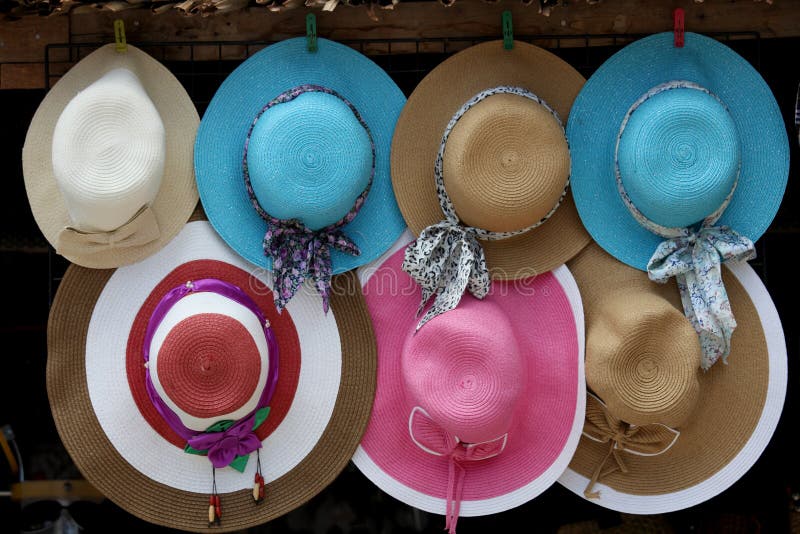
Find the location of a particular element. silk flower is located at coordinates (228, 439).